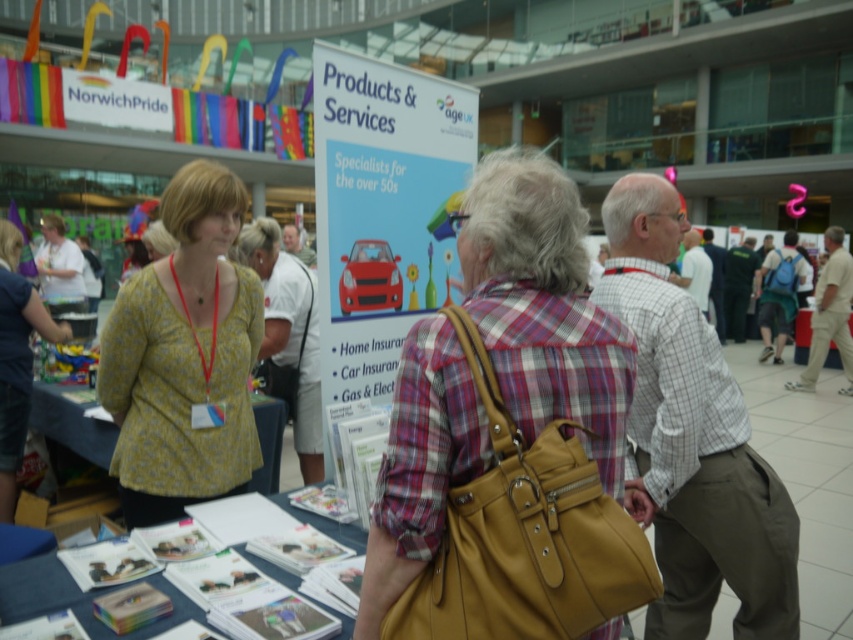
Question: Does leather handbag at center come behind light brown plaid shirt at right?

Choices:
 (A) no
 (B) yes

Answer: (A)

Question: Among these objects, which one is farthest from the camera?

Choices:
 (A) matte gray shirt at center
 (B) matte yellow blouse at center
 (C) leather handbag at center

Answer: (A)

Question: Which object is closer to the camera taking this photo?

Choices:
 (A) light brown plaid shirt at right
 (B) dark green uniform at center
 (C) blue backpack at right
 (D) yellow floral blouse at left

Answer: (A)

Question: Can you confirm if yellow floral blouse at center is thinner than matte gray shirt at center?

Choices:
 (A) no
 (B) yes

Answer: (A)

Question: Which point is closer to the camera?

Choices:
 (A) (689, 260)
 (B) (305, 246)
 (C) (428, 552)
 (D) (12, 406)

Answer: (C)

Question: In this image, where is yellow floral blouse at center located relative to light gray checkered shirt at center?

Choices:
 (A) above
 (B) below

Answer: (B)